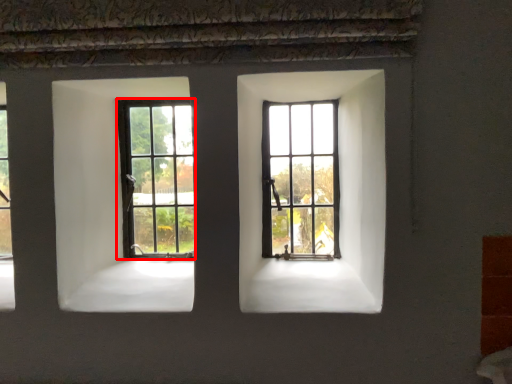
Question: From the image's perspective, considering the relative positions of window (annotated by the red box) and window in the image provided, where is window (annotated by the red box) located with respect to the staircase?

Choices:
 (A) above
 (B) below

Answer: (B)